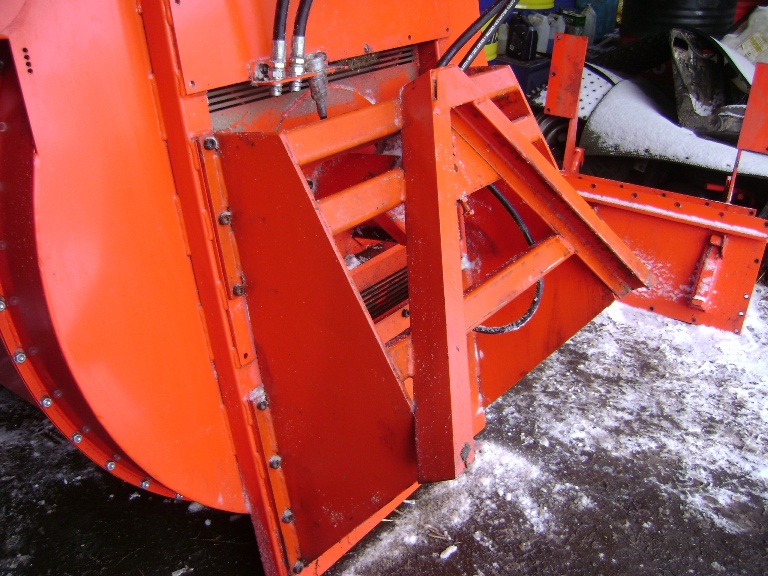
Locate an element on the screen. vent holes is located at coordinates (25, 49), (25, 56), (28, 65), (28, 72).